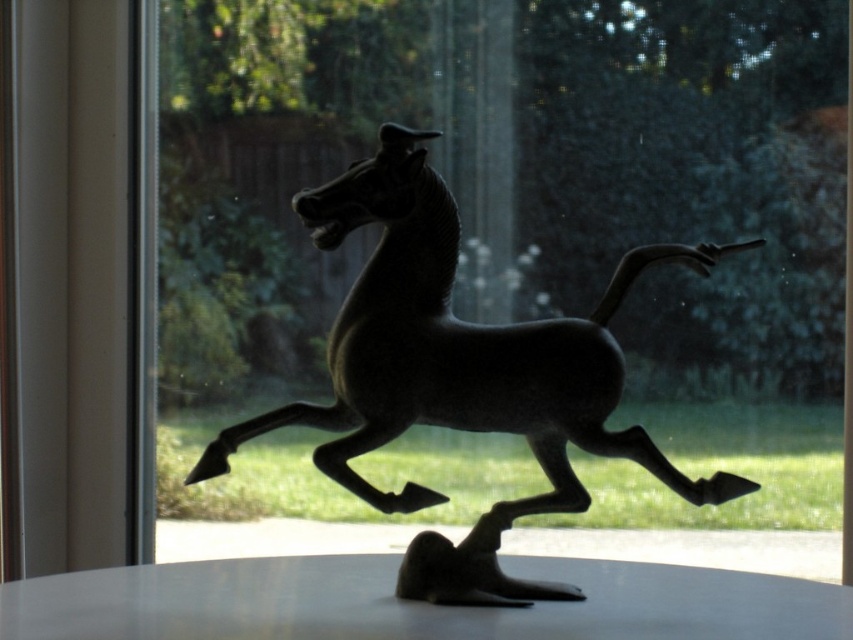
You are an art curator examining the metallic sculpture of a horse in the image. The sculpture is placed on a table or shelf. You notice a specific point marked at coordinates (x=459, y=349). What does this point indicate about the sculpture?

The point at coordinates (x=459, y=349) marks the shiny bronze horse at center, indicating its central position in the image.

You are an interior designer assessing the placement of the shiny bronze horse at center and the white glossy table at center. Based on their sizes, which object would you consider adjusting to ensure proper balance in the room?

The shiny bronze horse at center is bigger than the white glossy table at center. To achieve balance, you might consider adjusting the placement of the shiny bronze horse at center to a more central or focal point, while the smaller white glossy table at center could be positioned to complement the scale without overpowering the space.